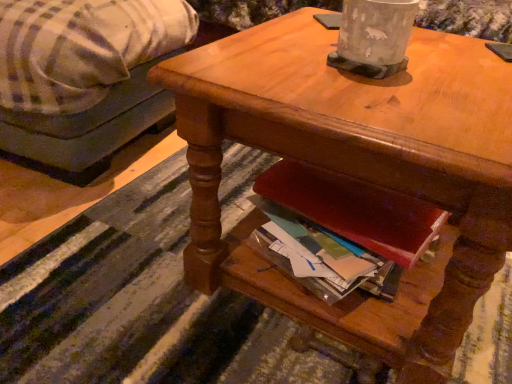
Question: Is wooden desk at center wider than plaid fabric couch at left?

Choices:
 (A) no
 (B) yes

Answer: (A)

Question: Could plaid fabric couch at left be considered to be inside wooden desk at center?

Choices:
 (A) no
 (B) yes

Answer: (A)

Question: From the image's perspective, is wooden desk at center over plaid fabric couch at left?

Choices:
 (A) no
 (B) yes

Answer: (A)

Question: Considering the relative sizes of wooden desk at center and plaid fabric couch at left in the image provided, is wooden desk at center taller than plaid fabric couch at left?

Choices:
 (A) yes
 (B) no

Answer: (B)

Question: Can we say wooden desk at center lies outside plaid fabric couch at left?

Choices:
 (A) no
 (B) yes

Answer: (B)

Question: From a real-world perspective, is wooden desk at center on top of plaid fabric couch at left?

Choices:
 (A) yes
 (B) no

Answer: (A)

Question: Can you see plaid fabric couch at left touching wooden desk at center?

Choices:
 (A) no
 (B) yes

Answer: (A)

Question: Is plaid fabric couch at left not close to wooden desk at center?

Choices:
 (A) yes
 (B) no

Answer: (B)

Question: Is wooden desk at center at the back of plaid fabric couch at left?

Choices:
 (A) yes
 (B) no

Answer: (B)

Question: Considering the relative sizes of plaid fabric couch at left and wooden desk at center in the image provided, is plaid fabric couch at left smaller than wooden desk at center?

Choices:
 (A) no
 (B) yes

Answer: (A)

Question: Is wooden desk at center surrounded by plaid fabric couch at left?

Choices:
 (A) yes
 (B) no

Answer: (B)

Question: From a real-world perspective, is plaid fabric couch at left on top of wooden desk at center?

Choices:
 (A) yes
 (B) no

Answer: (B)

Question: Does point (446, 263) appear closer or farther from the camera than point (68, 44)?

Choices:
 (A) farther
 (B) closer

Answer: (B)